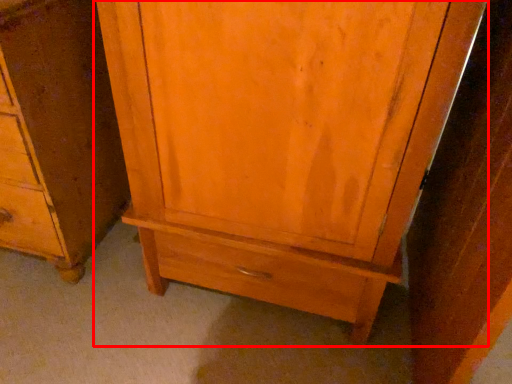
Question: In this image, where is cupboard (annotated by the red box) located relative to chest of drawers?

Choices:
 (A) left
 (B) right

Answer: (B)